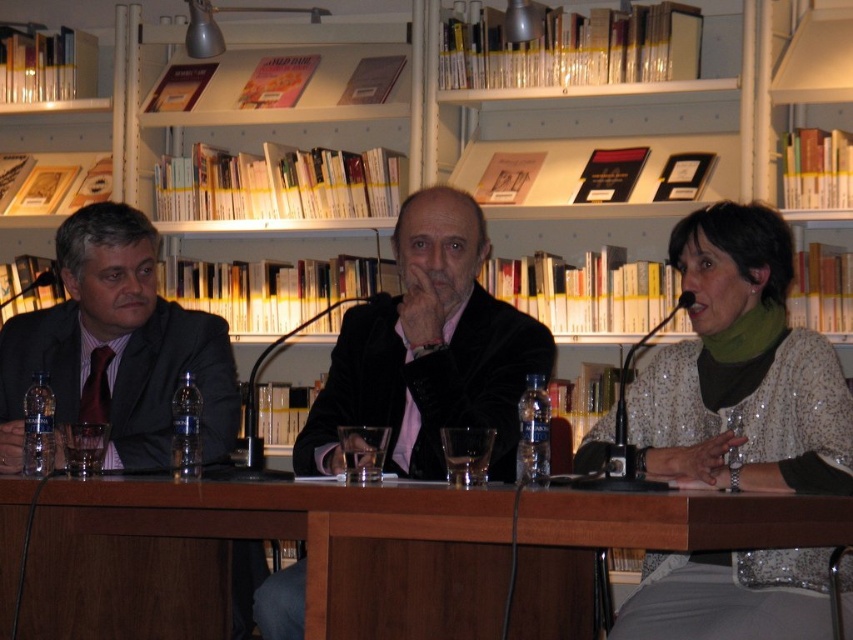
You are organizing a small event in this space and need to place a 60 cm wide table between the white glossy bookshelf at upper center and the matte black suit at left. Will there be enough space for the table?

The distance between the white glossy bookshelf at upper center and the matte black suit at left is 62.25 centimeters. Since the table is 60 cm wide, it will fit with 2.25 centimeters of space remaining.